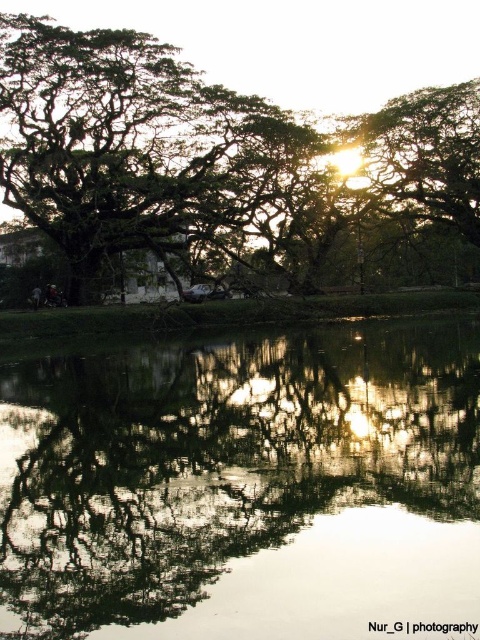
You are standing at the point with coordinates point [49,104] and want to walk to the point with coordinates point [324,396]. According to the scene description, will you have a clear path to walk towards your destination without any obstacles?

Yes, you will have a clear path to walk towards point [324,396] from point [49,104] because point [324,396] is in front of point [49,104], indicating no obstruction between them.

You are standing in the park and want to take a photo of the transparent water at center and the green leafy tree at upper left. Which object will appear larger in your photo?

The transparent water at center will appear larger in the photo because it is closer to the viewer than the green leafy tree at upper left.

You are standing at the edge of the transparent water at center and looking towards the green leafy tree at upper left. Which direction should you walk to get closer to the tree?

You should walk towards the upper left direction to get closer to the green leafy tree at upper left since it is located above the transparent water at center.